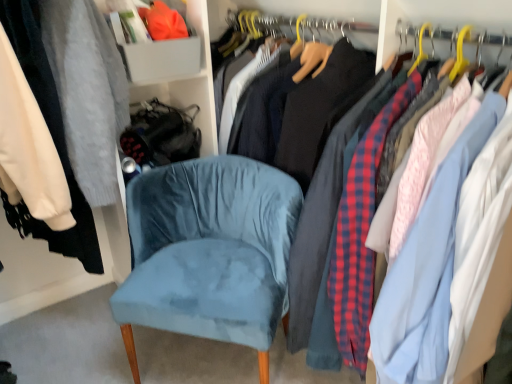
Where is `velvet blue chair at center`? This screenshot has height=384, width=512. velvet blue chair at center is located at coordinates (210, 249).

Describe the element at coordinates (210, 249) in the screenshot. Image resolution: width=512 pixels, height=384 pixels. I see `velvet blue chair at center` at that location.

You are a GUI agent. You are given a task and a screenshot of the screen. Output one action in this format:
    pyautogui.click(x=<x>, y=<y>)
    Task: Click on the velvet blue chair at center
    Image resolution: width=512 pixels, height=384 pixels.
    Given the screenshot: What is the action you would take?
    pyautogui.click(x=210, y=249)